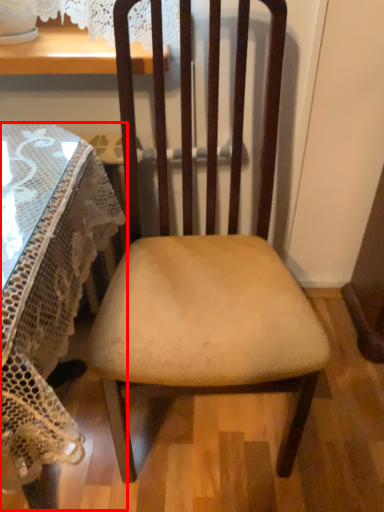
Question: From the image's perspective, where is table (annotated by the red box) located in relation to chair in the image?

Choices:
 (A) above
 (B) below

Answer: (B)